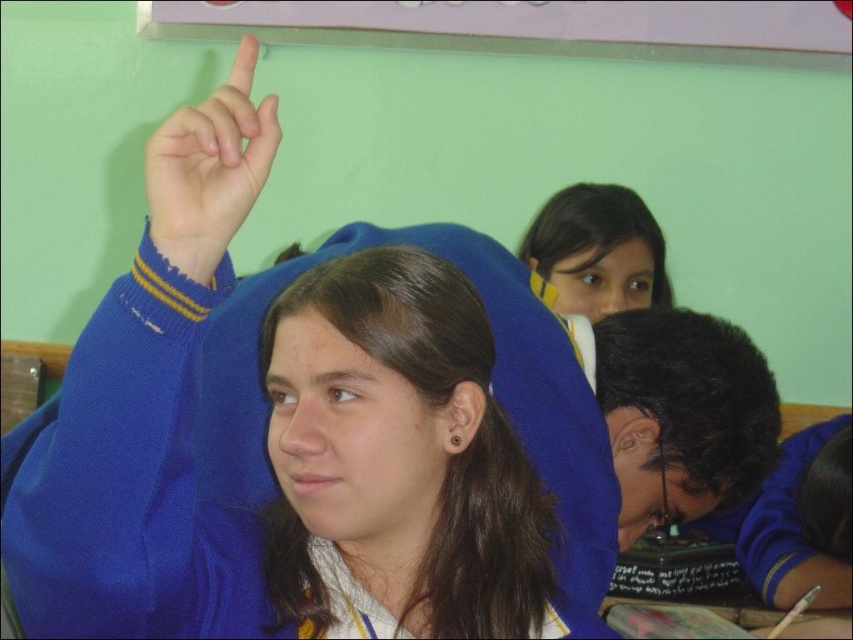
You are a student sitting in the classroom and want to see both the black matte hair at lower right and the matte blue hand at upper left. Which one appears bigger in size?

The black matte hair at lower right appears bigger in size compared to the matte blue hand at upper left.

You are a teacher standing at the front of the classroom. You notice two objects in the scene. One is the black matte hair at lower right and the other is the matte blue hand at upper left. Which object is closer to you?

The black matte hair at lower right is closer to you because it is further to the viewer than the matte blue hand at upper left.

You are a teacher observing the classroom. You notice two students wearing blue clothing. The first is wearing a blue knitted sweater at upper center, and the second is wearing a matte blue uniform at center. Which student is positioned higher in the classroom?

The blue knitted sweater at upper center is positioned higher in the classroom than the matte blue uniform at center.